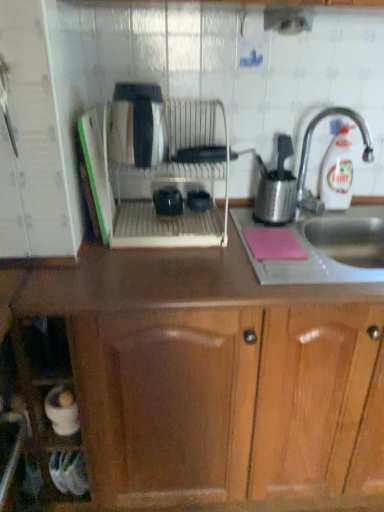
Where is `vacant area located to the right-hand side of matte black mugs at center, which is the second appliance in right-to-left order`? Image resolution: width=384 pixels, height=512 pixels. vacant area located to the right-hand side of matte black mugs at center, which is the second appliance in right-to-left order is located at coordinates (230, 221).